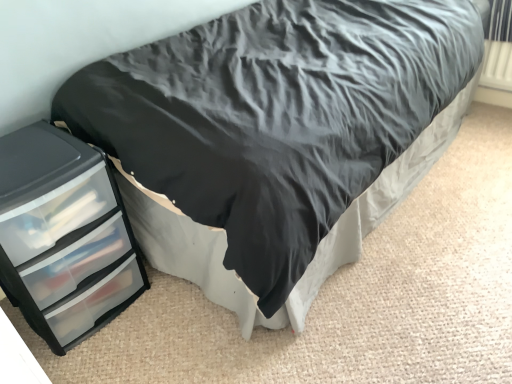
This screenshot has width=512, height=384. I want to click on transparent plastic chest of drawers at left, so click(x=64, y=236).

What is the approximate width of transparent plastic chest of drawers at left?

transparent plastic chest of drawers at left is 16.37 inches in width.

The width and height of the screenshot is (512, 384). Describe the element at coordinates (64, 236) in the screenshot. I see `transparent plastic chest of drawers at left` at that location.

What are the coordinates of `transparent plastic chest of drawers at left` in the screenshot? It's located at (64, 236).